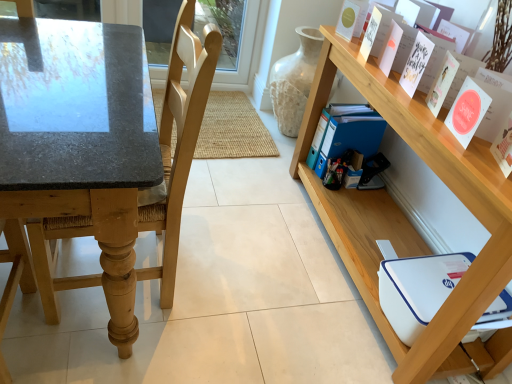
In order to click on free location in front of matte pink card at upper right, which is the fifth paperback book in back-to-front order in this screenshot , I will do `click(477, 165)`.